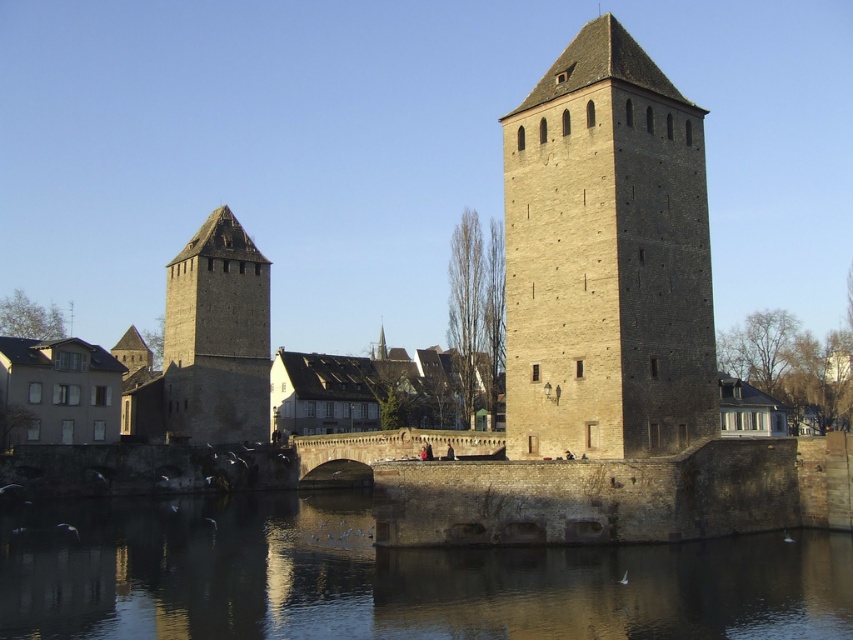
You are a tourist standing on the bridge between the two towers. You want to take a photo of the brown stone tower at left and the smooth stone water at lower center. In which direction should you point your camera to capture both in the frame?

To capture both the brown stone tower at left and the smooth stone water at lower center in the frame, you should point your camera to the right of the brown stone tower at left since the smooth stone water at lower center is located to the right of it.

You are an architect designing a new bridge that needs to incorporate two historical towers. The beige stone tower at center and the brown stone tower at left must be included. Which tower should you make narrower in your design to match their historical proportions?

The beige stone tower at center should be made narrower in the design since it is thinner than the brown stone tower at left historically.